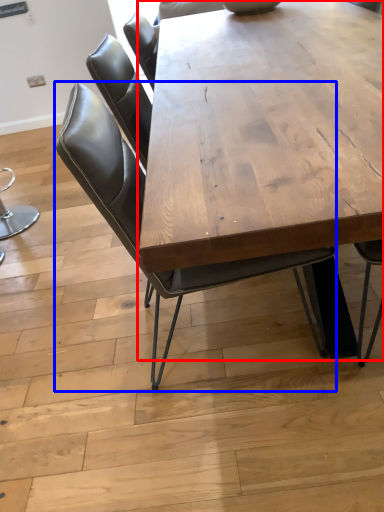
Question: Which object appears closest to the camera in this image, coffee table (highlighted by a red box) or chair (highlighted by a blue box)?

Choices:
 (A) coffee table
 (B) chair

Answer: (A)